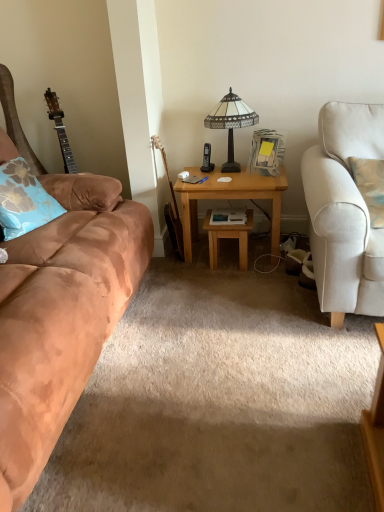
Question: Can you confirm if blue floral pillow at left is smaller than wooden table at center?

Choices:
 (A) yes
 (B) no

Answer: (B)

Question: Is blue floral pillow at left facing towards wooden table at center?

Choices:
 (A) no
 (B) yes

Answer: (A)

Question: Does blue floral pillow at left have a larger size compared to wooden table at center?

Choices:
 (A) no
 (B) yes

Answer: (B)

Question: From a real-world perspective, does blue floral pillow at left stand above wooden table at center?

Choices:
 (A) no
 (B) yes

Answer: (B)

Question: Considering the relative sizes of blue floral pillow at left and wooden table at center in the image provided, is blue floral pillow at left taller than wooden table at center?

Choices:
 (A) yes
 (B) no

Answer: (A)

Question: Is blue floral pillow at left next to wooden table at center?

Choices:
 (A) yes
 (B) no

Answer: (B)

Question: Is wooden acoustic guitar at center to the left of stained glass lamp at center from the viewer's perspective?

Choices:
 (A) no
 (B) yes

Answer: (B)

Question: Is stained glass lamp at center at the back of wooden acoustic guitar at center?

Choices:
 (A) no
 (B) yes

Answer: (A)

Question: Is wooden acoustic guitar at center bigger than stained glass lamp at center?

Choices:
 (A) yes
 (B) no

Answer: (B)

Question: From the image's perspective, is wooden acoustic guitar at center above stained glass lamp at center?

Choices:
 (A) no
 (B) yes

Answer: (A)

Question: Is wooden acoustic guitar at center thinner than stained glass lamp at center?

Choices:
 (A) no
 (B) yes

Answer: (B)

Question: Is wooden acoustic guitar at center aimed at stained glass lamp at center?

Choices:
 (A) no
 (B) yes

Answer: (A)

Question: From a real-world perspective, is wooden acoustic guitar at center below blue floral pillow at left?

Choices:
 (A) yes
 (B) no

Answer: (A)